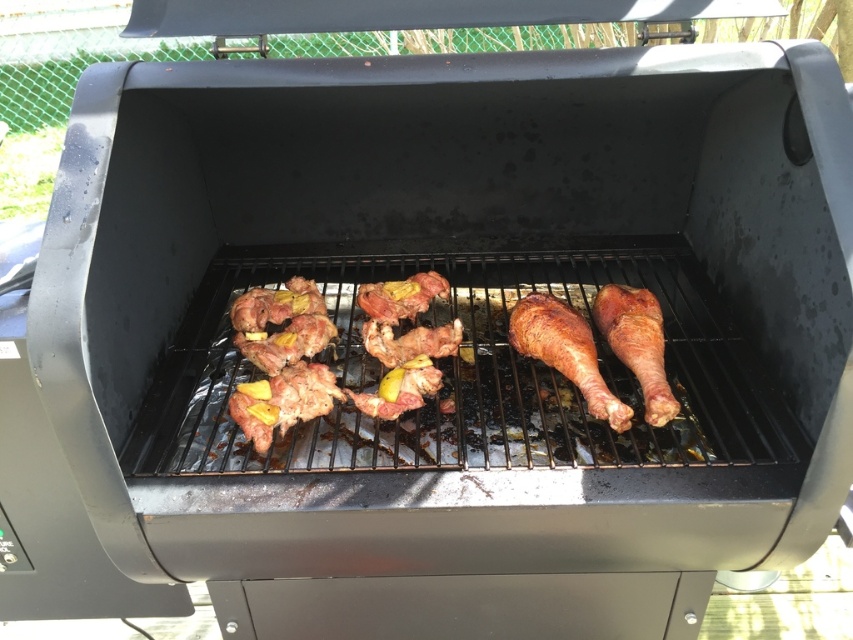
You are a drone operator trying to deliver a small package to a point near the grill. You have two coordinates to choose from in the image. Which coordinate, point (383, 406) or point (403, 305), is closer to the viewer and thus easier to reach?

Point (383, 406) is closer to the viewer than point (403, 305), so it is easier to reach.